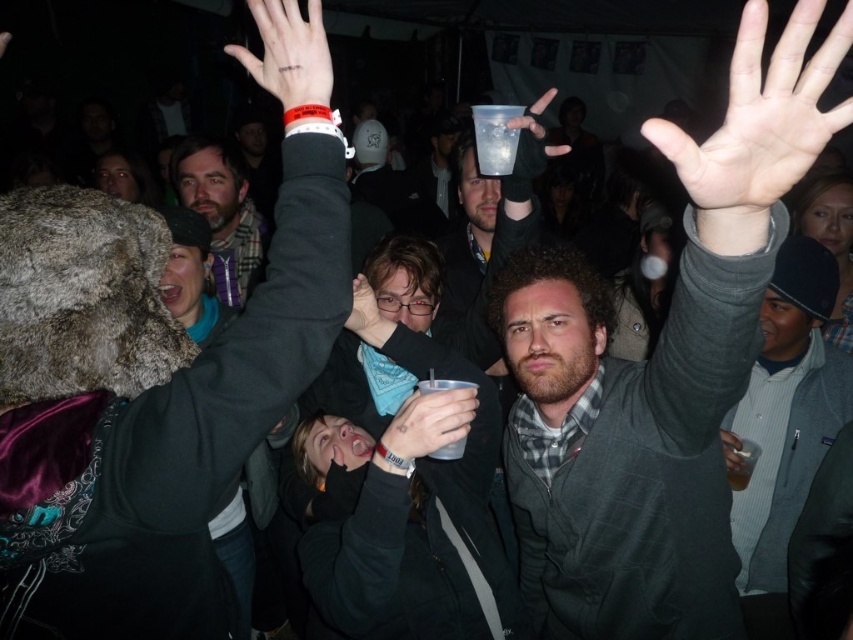
Which of these two, matte black wristband at upper center or metallic silver cup at center, stands taller?

With more height is matte black wristband at upper center.

In order to click on matte black wristband at upper center in this screenshot , I will do `click(288, 52)`.

Does point (784, 330) lie in front of point (463, 440)?

No, it is behind (463, 440).

Is gray woolen sweater at upper right further to the viewer compared to metallic silver cup at center?

Yes, it is behind metallic silver cup at center.

Locate an element on the screen. The width and height of the screenshot is (853, 640). gray woolen sweater at upper right is located at coordinates (785, 419).

Where is `gray woolen sweater at upper right`? The width and height of the screenshot is (853, 640). gray woolen sweater at upper right is located at coordinates pos(785,419).

Who is more distant from viewer, (699, 545) or (477, 108)?

The point (477, 108) is more distant.

Find the location of `gray wool sweater at center`. gray wool sweater at center is located at coordinates (659, 369).